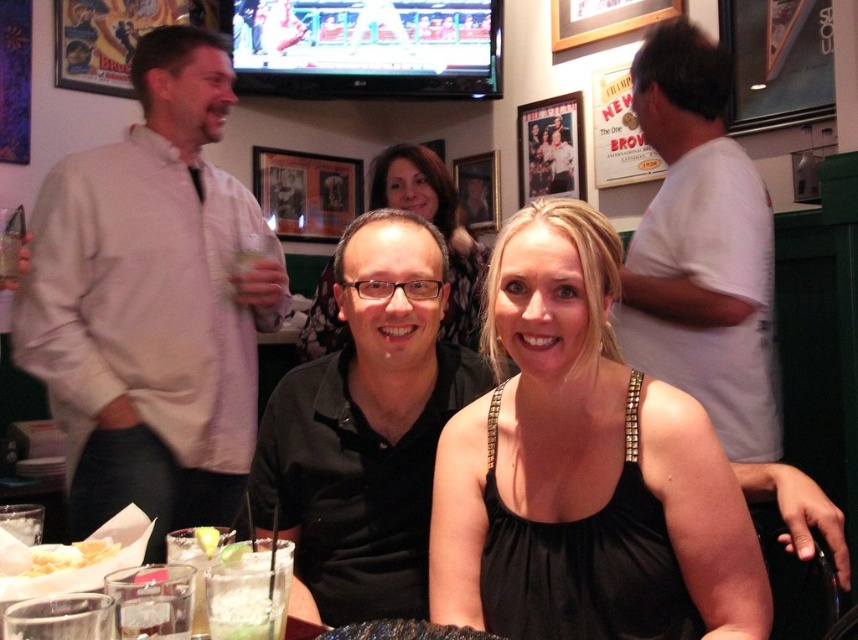
Question: Which point is closer to the camera?

Choices:
 (A) matte black dress at center
 (B) black matte shirt at center

Answer: (B)

Question: Which point is closer to the camera?

Choices:
 (A) (76, 566)
 (B) (466, 316)

Answer: (A)

Question: Is white shirt at left to the left of white crispy fries at lower left from the viewer's perspective?

Choices:
 (A) no
 (B) yes

Answer: (B)

Question: Can you confirm if black satin dress at center is bigger than black matte shirt at center?

Choices:
 (A) yes
 (B) no

Answer: (A)

Question: Is white shirt at left positioned before white cotton t-shirt at right?

Choices:
 (A) yes
 (B) no

Answer: (A)

Question: Which point is farther to the camera?

Choices:
 (A) white crispy fries at lower left
 (B) black matte shirt at center
 (C) black satin dress at center
 (D) matte black dress at center

Answer: (D)